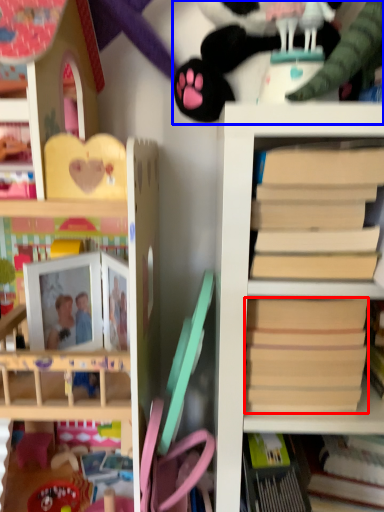
Question: Which object appears closest to the camera in this image, paperback book (highlighted by a red box) or toy (highlighted by a blue box)?

Choices:
 (A) paperback book
 (B) toy

Answer: (A)